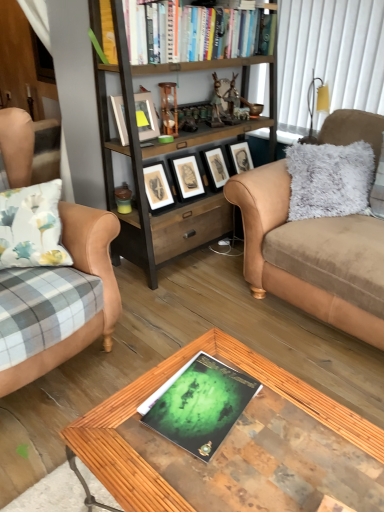
Locate an element on the screen. free space above green matte magazine at center (from a real-world perspective) is located at coordinates (210, 393).